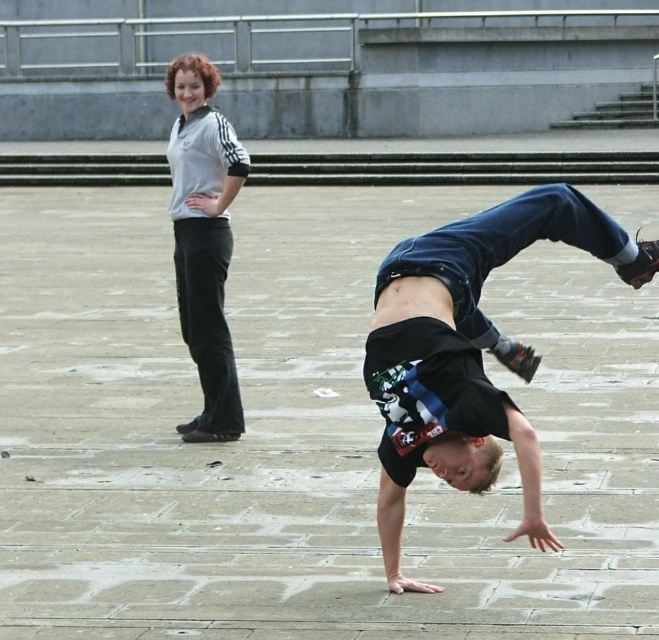
You are standing at point (430, 364) and want to walk to point (208, 438). Which direction should you move relative to the handstand performer?

You should move behind the handstand performer because point (430, 364) is in front of point (208, 438), so to reach the latter, you need to go behind the performer.

You are a photographer trying to capture a photo of the black cotton shirt at center and the white matte pants at upper left. Since you want both items to appear equally prominent in the photo, which object should you zoom in on more?

The black cotton shirt at center has a larger size compared to white matte pants at upper left, so you should zoom in more on the white matte pants at upper left to make them appear equally prominent.